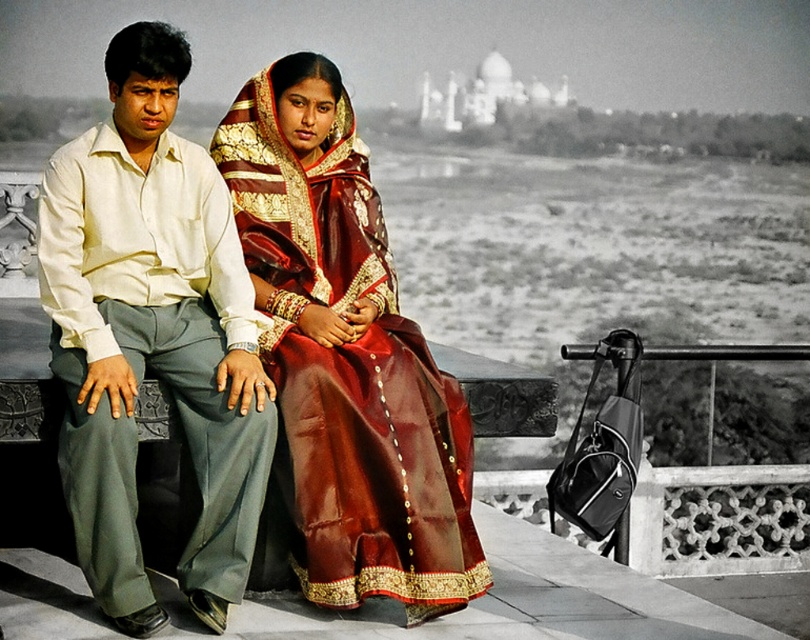
Question: Considering the relative positions of light beige cotton shirt at left and shiny silk saree at center in the image provided, where is light beige cotton shirt at left located with respect to shiny silk saree at center?

Choices:
 (A) right
 (B) left

Answer: (B)

Question: Can you confirm if light beige cotton shirt at left is wider than shiny silk saree at center?

Choices:
 (A) no
 (B) yes

Answer: (A)

Question: Among these objects, which one is farthest from the camera?

Choices:
 (A) light beige cotton shirt at left
 (B) shiny silk saree at center

Answer: (B)

Question: Which of the following is the farthest from the observer?

Choices:
 (A) (265, 305)
 (B) (212, 541)

Answer: (A)

Question: Does light beige cotton shirt at left have a greater width compared to shiny silk saree at center?

Choices:
 (A) yes
 (B) no

Answer: (B)